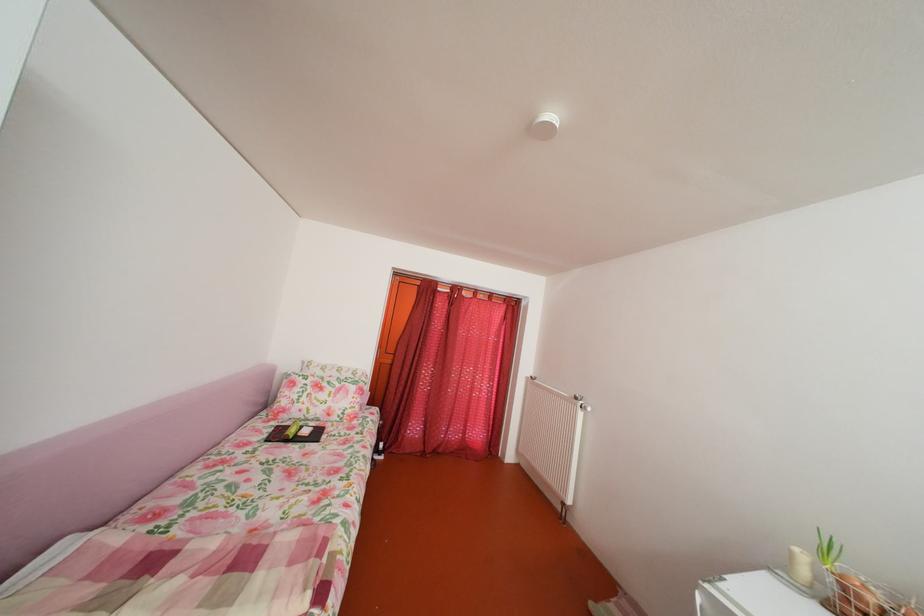
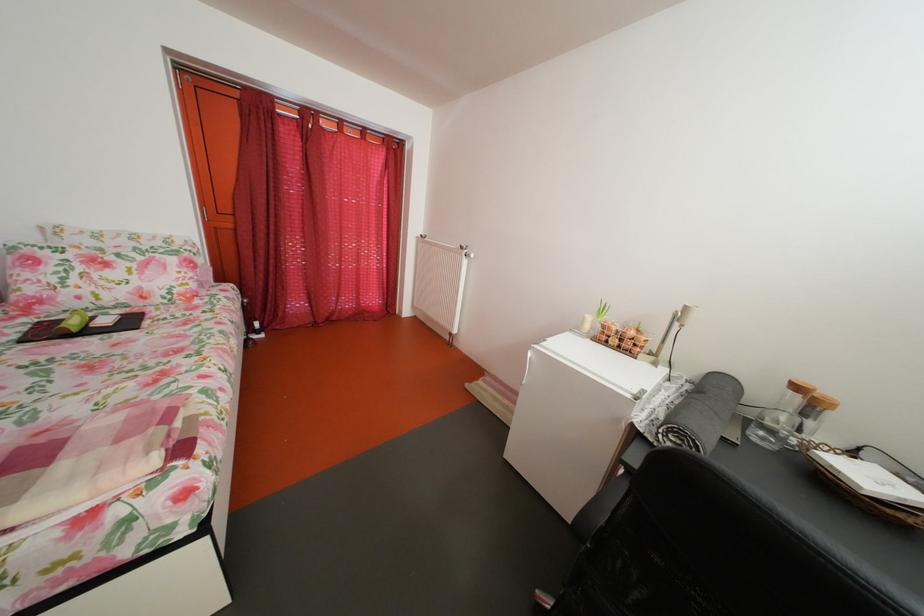
Locate, in the second image, the point that corresponds to point 588,405 in the first image.

(473, 254)